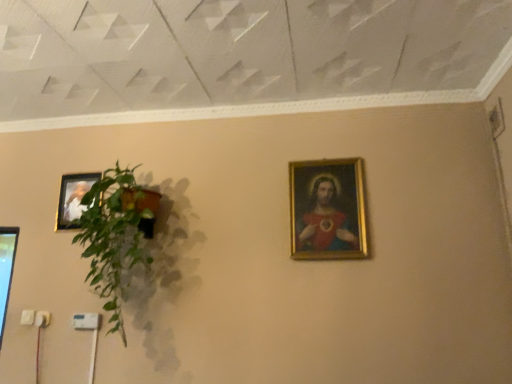
Question: From the image's perspective, is matte gold picture frame at upper left, placed as the 2th picture frame when sorted from right to left, beneath gold-framed painting at upper right, which is the 1th picture frame from right to left?

Choices:
 (A) no
 (B) yes

Answer: (A)

Question: Considering the relative sizes of matte gold picture frame at upper left, marked as the 2th picture frame in a front-to-back arrangement, and gold-framed painting at upper right, positioned as the second picture frame in back-to-front order, in the image provided, is matte gold picture frame at upper left, marked as the 2th picture frame in a front-to-back arrangement, thinner than gold-framed painting at upper right, positioned as the second picture frame in back-to-front order,?

Choices:
 (A) yes
 (B) no

Answer: (B)

Question: Is matte gold picture frame at upper left, marked as the 2th picture frame in a front-to-back arrangement, to the left of gold-framed painting at upper right, the 1th picture frame from the front, from the viewer's perspective?

Choices:
 (A) no
 (B) yes

Answer: (B)

Question: Is matte gold picture frame at upper left, placed as the 2th picture frame when sorted from right to left, outside gold-framed painting at upper right, the 1th picture frame from the front?

Choices:
 (A) no
 (B) yes

Answer: (B)

Question: Is matte gold picture frame at upper left, arranged as the first picture frame when viewed from the back, surrounding gold-framed painting at upper right, the 1th picture frame from the front?

Choices:
 (A) no
 (B) yes

Answer: (A)

Question: Considering the relative sizes of matte gold picture frame at upper left, placed as the 2th picture frame when sorted from right to left, and gold-framed painting at upper right, the 1th picture frame from the front, in the image provided, is matte gold picture frame at upper left, placed as the 2th picture frame when sorted from right to left, taller than gold-framed painting at upper right, the 1th picture frame from the front,?

Choices:
 (A) yes
 (B) no

Answer: (B)

Question: Is green leafy plant at left wider than gold-framed painting at upper right, the 1th picture frame from the front?

Choices:
 (A) yes
 (B) no

Answer: (A)

Question: Is green leafy plant at left to the right of gold-framed painting at upper right, positioned as the second picture frame in back-to-front order, from the viewer's perspective?

Choices:
 (A) no
 (B) yes

Answer: (A)

Question: Is green leafy plant at left bigger than gold-framed painting at upper right, which is the 1th picture frame from right to left?

Choices:
 (A) yes
 (B) no

Answer: (A)

Question: Is green leafy plant at left not within gold-framed painting at upper right, the 1th picture frame from the front?

Choices:
 (A) yes
 (B) no

Answer: (A)

Question: Is green leafy plant at left positioned in front of gold-framed painting at upper right, which is the 1th picture frame from right to left?

Choices:
 (A) no
 (B) yes

Answer: (B)

Question: From a real-world perspective, is green leafy plant at left below gold-framed painting at upper right, which ranks as the second picture frame in left-to-right order?

Choices:
 (A) no
 (B) yes

Answer: (B)

Question: Can you confirm if gold-framed painting at upper right, which ranks as the second picture frame in left-to-right order, is smaller than matte gold picture frame at upper left, placed as the 2th picture frame when sorted from right to left?

Choices:
 (A) no
 (B) yes

Answer: (A)